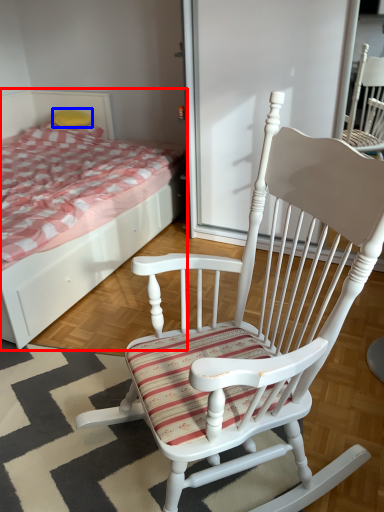
Question: Which of the following is the closest to the observer, bed (highlighted by a red box) or pillow (highlighted by a blue box)?

Choices:
 (A) bed
 (B) pillow

Answer: (A)